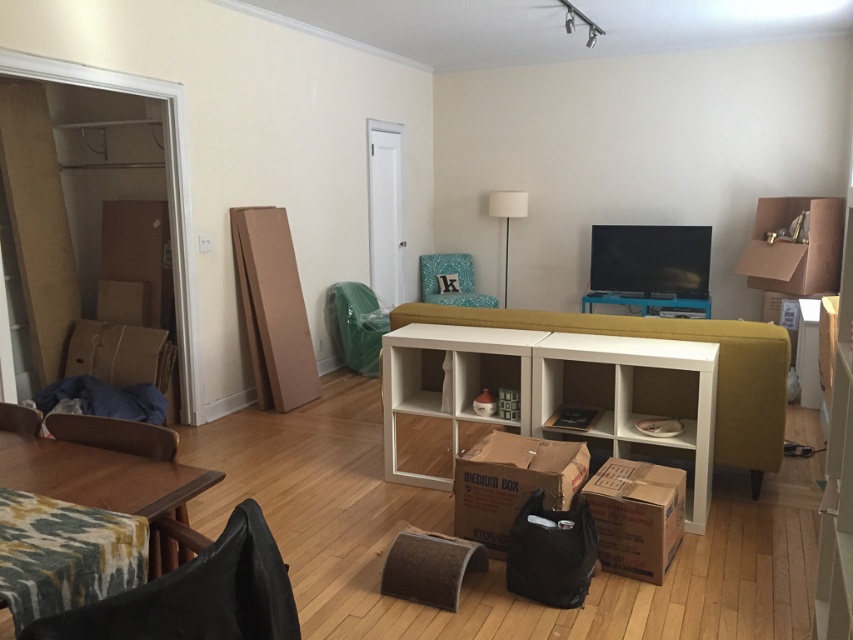
Question: Among these objects, which one is nearest to the camera?

Choices:
 (A) patterned fabric armchair at lower left
 (B) teal fabric armchair at center

Answer: (A)

Question: Which point is farther to the camera?

Choices:
 (A) wooden table at lower left
 (B) brown cardboard box at center

Answer: (B)

Question: Is brown cardboard box at lower right below velvet green armchair at lower left?

Choices:
 (A) yes
 (B) no

Answer: (A)

Question: In this image, where is brown cardboard box at lower right located relative to wooden armchair at lower left?

Choices:
 (A) right
 (B) left

Answer: (A)

Question: Can you confirm if teal fabric armchair at center is positioned above white fabric lamp at center?

Choices:
 (A) yes
 (B) no

Answer: (B)

Question: Among these points, which one is nearest to the camera?

Choices:
 (A) (186, 579)
 (B) (119, 424)
 (C) (509, 461)
 (D) (439, 296)

Answer: (A)